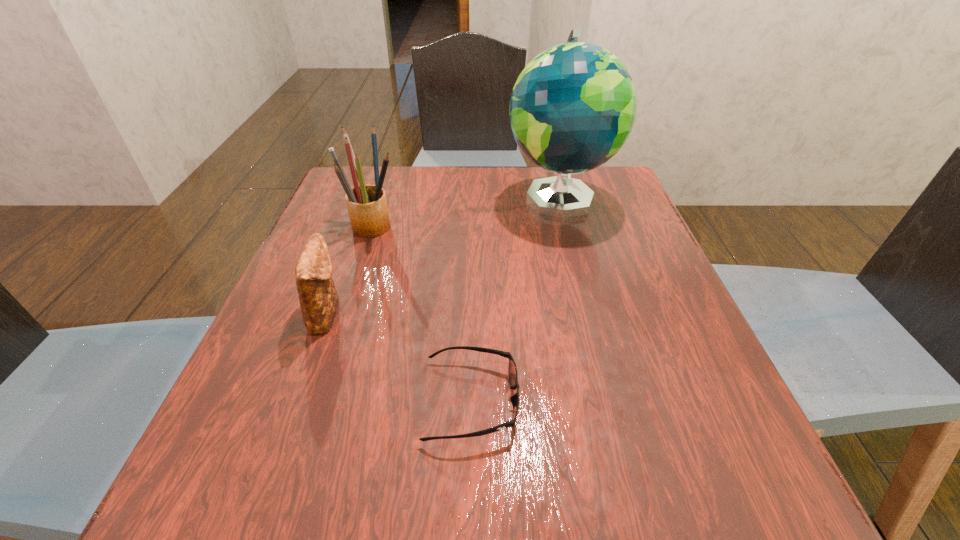
I want to click on blank space located on the front-facing side of the second object from right to left, so click(714, 400).

At what (x,y) coordinates should I click in order to perform the action: click on globe located in the far edge section of the desktop. Please return your answer as a coordinate pair (x, y). Looking at the image, I should click on (572, 108).

The image size is (960, 540). Find the location of `pencil box present at the far edge`. pencil box present at the far edge is located at coordinates (367, 206).

Where is `pencil box situated at the left edge`? The width and height of the screenshot is (960, 540). pencil box situated at the left edge is located at coordinates (367, 206).

Locate an element on the screen. This screenshot has height=540, width=960. clutch bag positioned at the left edge is located at coordinates (318, 298).

Locate an element on the screen. This screenshot has width=960, height=540. object that is at the right edge is located at coordinates (572, 108).

In order to click on object that is positioned at the far left corner in this screenshot , I will do `click(367, 206)`.

You are a GUI agent. You are given a task and a screenshot of the screen. Output one action in this format:
    pyautogui.click(x=<x>, y=<y>)
    Task: Click on the object present at the far right corner
    
    Given the screenshot: What is the action you would take?
    pyautogui.click(x=572, y=108)

Identify the location of blank space at the far edge of the desktop. The height and width of the screenshot is (540, 960). (405, 173).

Where is `vacant space at the near edge of the desktop`? This screenshot has width=960, height=540. vacant space at the near edge of the desktop is located at coordinates (532, 516).